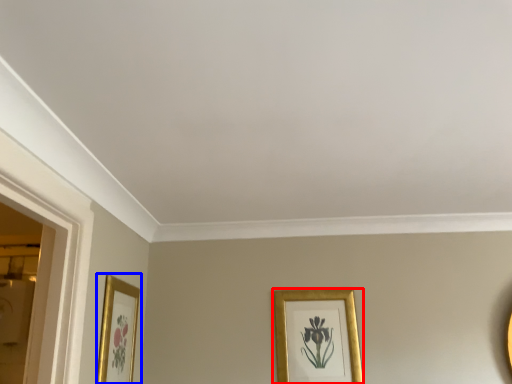
Question: Which point is closer to the camera, picture frame (highlighted by a red box) or picture frame (highlighted by a blue box)?

Choices:
 (A) picture frame
 (B) picture frame

Answer: (B)